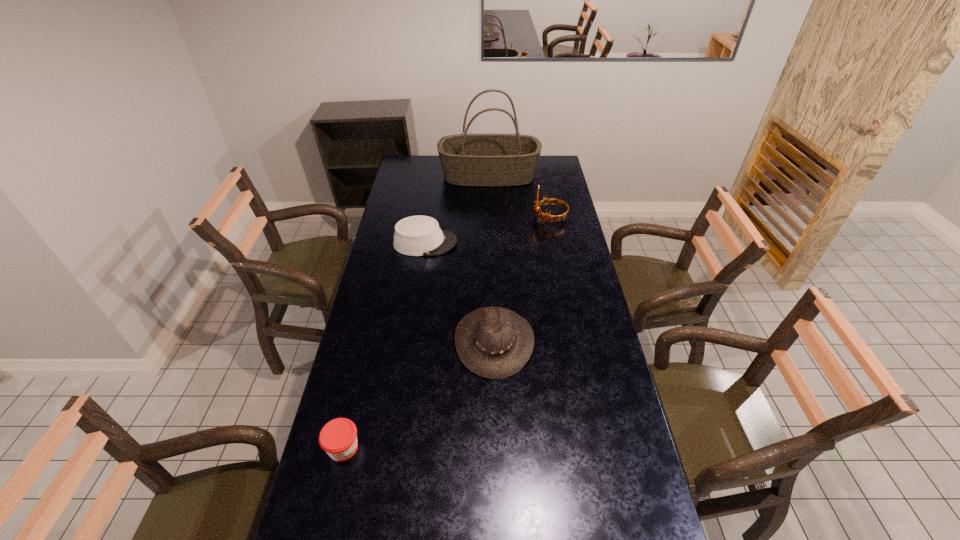
Image resolution: width=960 pixels, height=540 pixels. In order to click on empty space between the second tallest object and the right hat in this screenshot , I will do `click(522, 279)`.

Where is `free space between the right hat and the left hat`? The image size is (960, 540). free space between the right hat and the left hat is located at coordinates (460, 292).

Find the location of a particular element. Image resolution: width=960 pixels, height=540 pixels. empty space that is in between the tallest object and the fourth shortest object is located at coordinates (519, 197).

At what (x,y) coordinates should I click in order to perform the action: click on free space between the nearer hat and the farther hat. Please return your answer as a coordinate pair (x, y). The height and width of the screenshot is (540, 960). Looking at the image, I should click on (460, 292).

The image size is (960, 540). Find the location of `free spot between the third farthest object and the nearest object`. free spot between the third farthest object and the nearest object is located at coordinates click(384, 346).

Image resolution: width=960 pixels, height=540 pixels. Find the location of `empty space between the nearest object and the left hat`. empty space between the nearest object and the left hat is located at coordinates (384, 346).

Where is `unoccupied area between the right hat and the farther hat`? This screenshot has height=540, width=960. unoccupied area between the right hat and the farther hat is located at coordinates (460, 292).

Find the location of `object that is the fourth closest to the fourth farthest object`. object that is the fourth closest to the fourth farthest object is located at coordinates (485, 160).

Find the location of `object that is the third closest to the tiara`. object that is the third closest to the tiara is located at coordinates (495, 343).